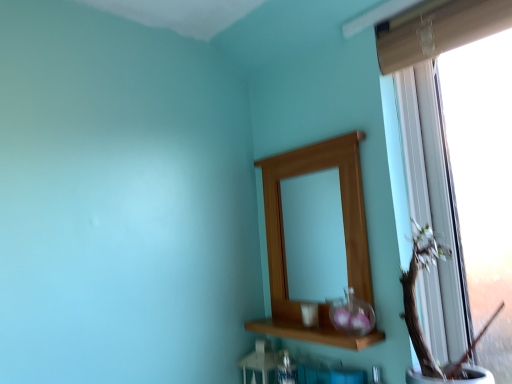
Question: Is transparent glass vase at center at the right side of wooden vase at right?

Choices:
 (A) no
 (B) yes

Answer: (A)

Question: Is transparent glass vase at center closer to the viewer compared to wooden vase at right?

Choices:
 (A) no
 (B) yes

Answer: (A)

Question: Is transparent glass vase at center positioned with its back to wooden vase at right?

Choices:
 (A) yes
 (B) no

Answer: (B)

Question: From a real-world perspective, does transparent glass vase at center sit lower than wooden vase at right?

Choices:
 (A) yes
 (B) no

Answer: (A)

Question: Does transparent glass vase at center come behind wooden vase at right?

Choices:
 (A) yes
 (B) no

Answer: (A)

Question: Is point (262, 319) closer or farther from the camera than point (370, 269)?

Choices:
 (A) closer
 (B) farther

Answer: (B)

Question: In terms of height, does wooden shelf at center look taller or shorter compared to wooden mirror at upper center?

Choices:
 (A) tall
 (B) short

Answer: (B)

Question: Do you think wooden shelf at center is within wooden mirror at upper center, or outside of it?

Choices:
 (A) inside
 (B) outside

Answer: (B)

Question: Is wooden shelf at center in front of or behind wooden mirror at upper center in the image?

Choices:
 (A) front
 (B) behind

Answer: (A)

Question: Is point (337, 311) closer or farther from the camera than point (359, 208)?

Choices:
 (A) farther
 (B) closer

Answer: (B)

Question: Is transparent glass vase at center situated inside wooden mirror at upper center or outside?

Choices:
 (A) inside
 (B) outside

Answer: (A)

Question: Visually, is transparent glass vase at center positioned to the left or to the right of wooden mirror at upper center?

Choices:
 (A) right
 (B) left

Answer: (A)

Question: In terms of width, does transparent glass vase at center look wider or thinner when compared to wooden mirror at upper center?

Choices:
 (A) thin
 (B) wide

Answer: (B)

Question: Looking at the image, does wooden shelf at center seem bigger or smaller compared to transparent glass vase at center?

Choices:
 (A) big
 (B) small

Answer: (A)

Question: From a real-world perspective, is wooden shelf at center positioned above or below transparent glass vase at center?

Choices:
 (A) above
 (B) below

Answer: (B)